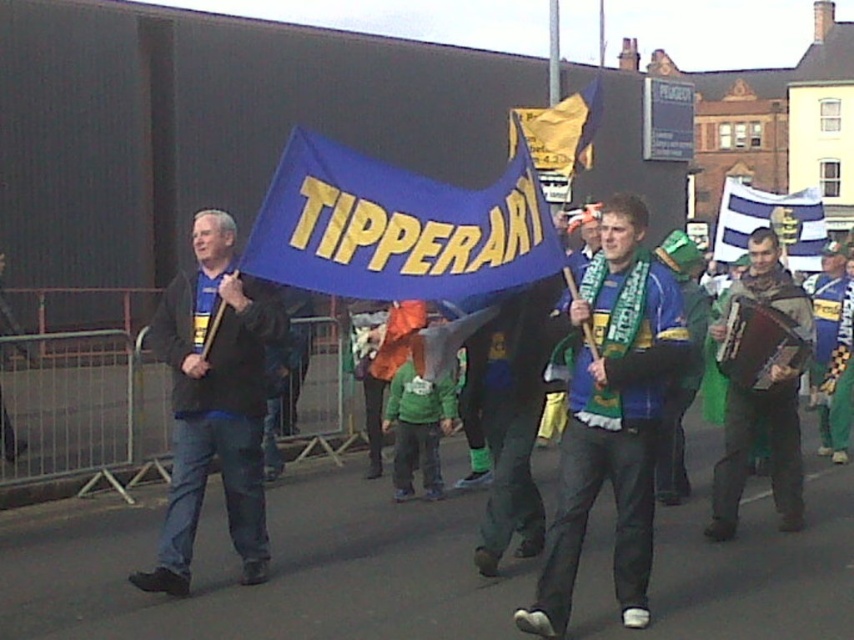
You are a photographer standing at the origin point of the image coordinate system. You need to capture a closeup shot of the green knitted scarf at center. What are the coordinates where you should aim your camera?

The coordinates to aim the camera are at point (x=510, y=417) to capture the green knitted scarf at center.

You are a photographer standing in the middle of the street. You notice the dark blue jeans at left and the brown leather accordion at right. Which object is closer to the ground?

The dark blue jeans at left is positioned under the brown leather accordion at right, so the dark blue jeans at left is closer to the ground.

You are a photographer standing at the center of the street. You want to take a photo that includes both the dark blue jeans at left and the brown leather accordion at right. What is the minimum distance you need to move backward to ensure both objects are in frame?

The dark blue jeans at left is 3.76 meters from the brown leather accordion at right. To capture both in the frame, you need to move backward until the distance between them fits within your camera lens field of view. Assuming a standard lens with a 50mm focal length, the minimum distance to move back would depend on the sensor size and desired framing, but generally, being at least 4 meters away should ensure both objects are in frame.